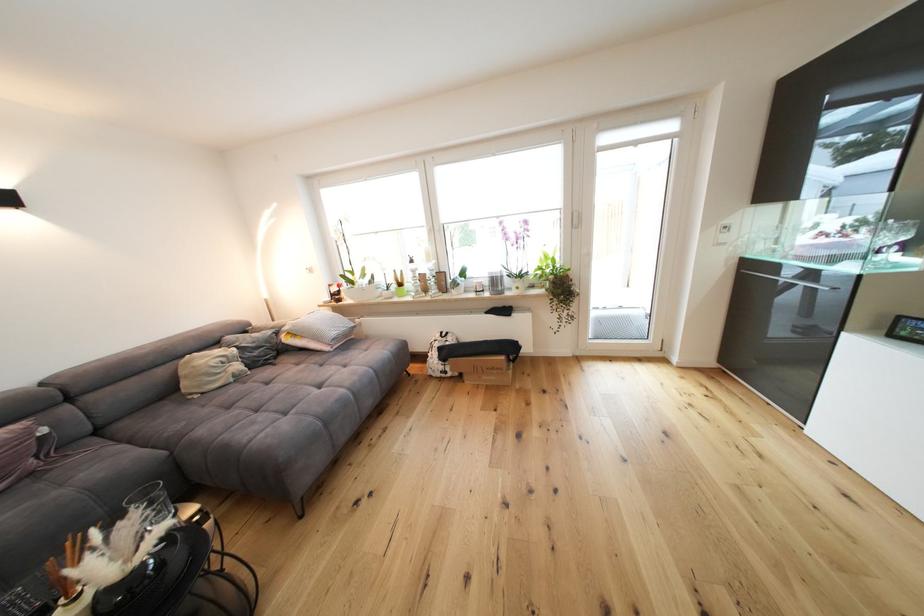
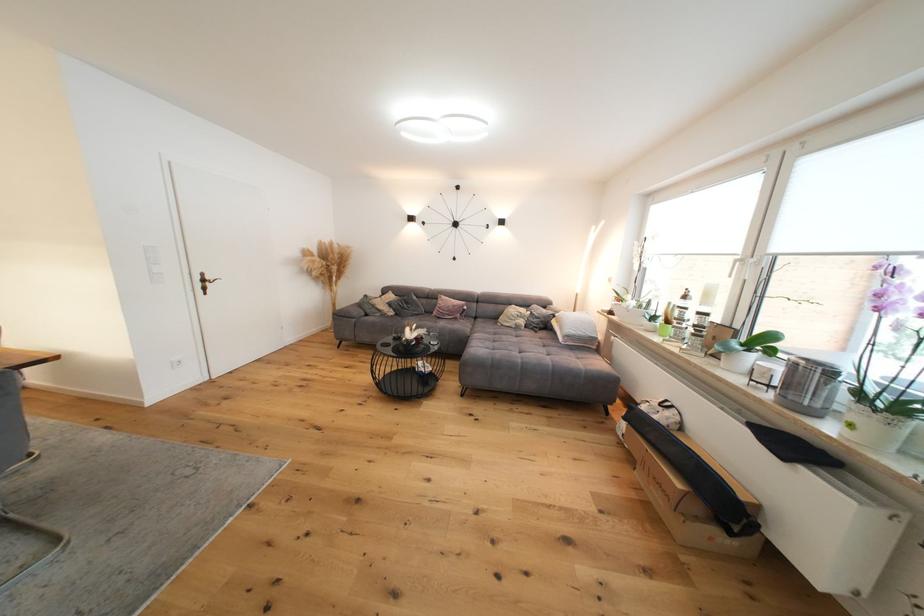
Where in the second image is the point corresponding to point (511, 359) from the first image?

(687, 488)